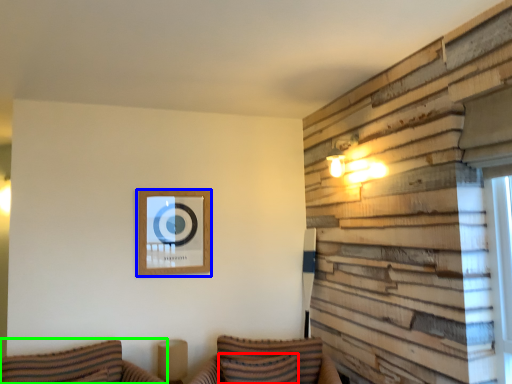
Question: Estimate the real-world distances between objects in this image. Which object is farther from pillow (highlighted by a red box), picture frame (highlighted by a blue box) or couch (highlighted by a green box)?

Choices:
 (A) picture frame
 (B) couch

Answer: (A)